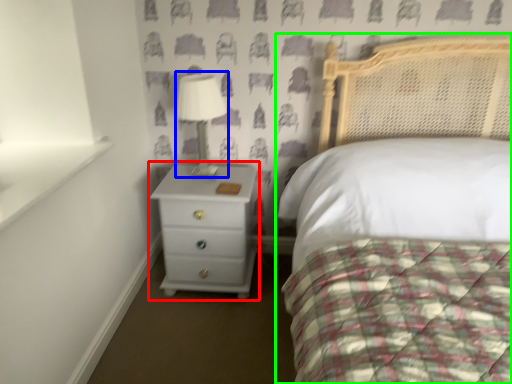
Question: Which object is the closest to the chest of drawers (highlighted by a red box)? Choose among these: table lamp (highlighted by a blue box) or bed (highlighted by a green box).

Choices:
 (A) table lamp
 (B) bed

Answer: (A)